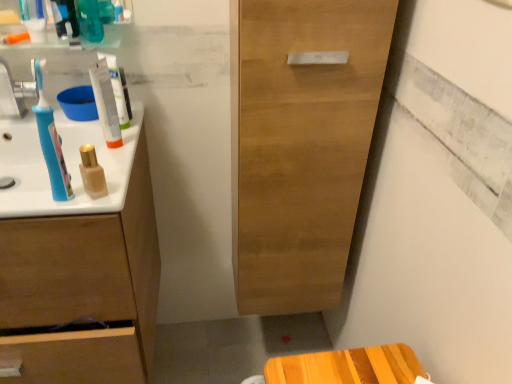
Question: From the image's perspective, is blue plastic toothbrush at left below blue plastic toothbrush at left?

Choices:
 (A) no
 (B) yes

Answer: (A)

Question: Does blue plastic toothbrush at left have a smaller size compared to blue plastic toothbrush at left?

Choices:
 (A) no
 (B) yes

Answer: (A)

Question: Could you tell me if blue plastic toothbrush at left is turned towards blue plastic toothbrush at left?

Choices:
 (A) yes
 (B) no

Answer: (B)

Question: Is blue plastic toothbrush at left looking in the opposite direction of blue plastic toothbrush at left?

Choices:
 (A) yes
 (B) no

Answer: (B)

Question: Could blue plastic toothbrush at left be considered to be inside blue plastic toothbrush at left?

Choices:
 (A) yes
 (B) no

Answer: (B)

Question: Considering the relative positions of blue plastic toothbrush at left and blue plastic toothbrush at left in the image provided, is blue plastic toothbrush at left to the right of blue plastic toothbrush at left from the viewer's perspective?

Choices:
 (A) yes
 (B) no

Answer: (B)

Question: Is white glossy tube at upper center smaller than matte beige bottle at center, which is the second mouthwash in top-to-bottom order?

Choices:
 (A) no
 (B) yes

Answer: (A)

Question: Is white glossy tube at upper center positioned in front of matte beige bottle at center, which appears as the 1th mouthwash when viewed from the right?

Choices:
 (A) no
 (B) yes

Answer: (A)

Question: Can you confirm if white glossy tube at upper center is positioned to the left of matte beige bottle at center, the first mouthwash from the bottom?

Choices:
 (A) yes
 (B) no

Answer: (A)

Question: Can you confirm if white glossy tube at upper center is positioned to the right of matte beige bottle at center, the first mouthwash from the bottom?

Choices:
 (A) yes
 (B) no

Answer: (B)

Question: Is matte beige bottle at center, the first mouthwash from the bottom, at the back of white glossy tube at upper center?

Choices:
 (A) yes
 (B) no

Answer: (B)

Question: Is the position of white glossy tube at upper center more distant than that of matte beige bottle at center, the 1th mouthwash viewed from the front?

Choices:
 (A) no
 (B) yes

Answer: (B)

Question: Is the surface of blue plastic toothbrush at left in direct contact with matte beige bottle at center, the 2th mouthwash in the back-to-front sequence?

Choices:
 (A) no
 (B) yes

Answer: (B)